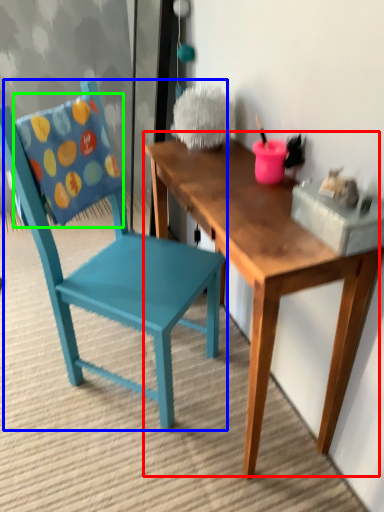
Question: Which is farther away from table (highlighted by a red box)? chair (highlighted by a blue box) or pillow (highlighted by a green box)?

Choices:
 (A) chair
 (B) pillow

Answer: (B)